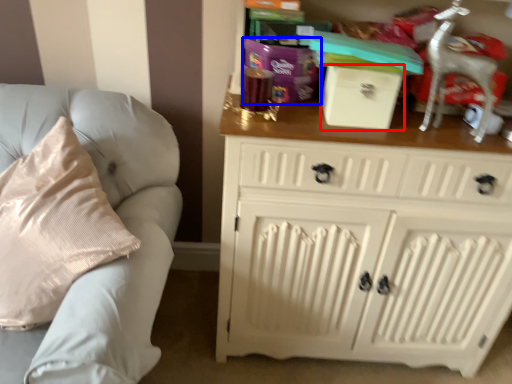
Question: Among these objects, which one is nearest to the camera, box (highlighted by a red box) or gift (highlighted by a blue box)?

Choices:
 (A) box
 (B) gift

Answer: (A)